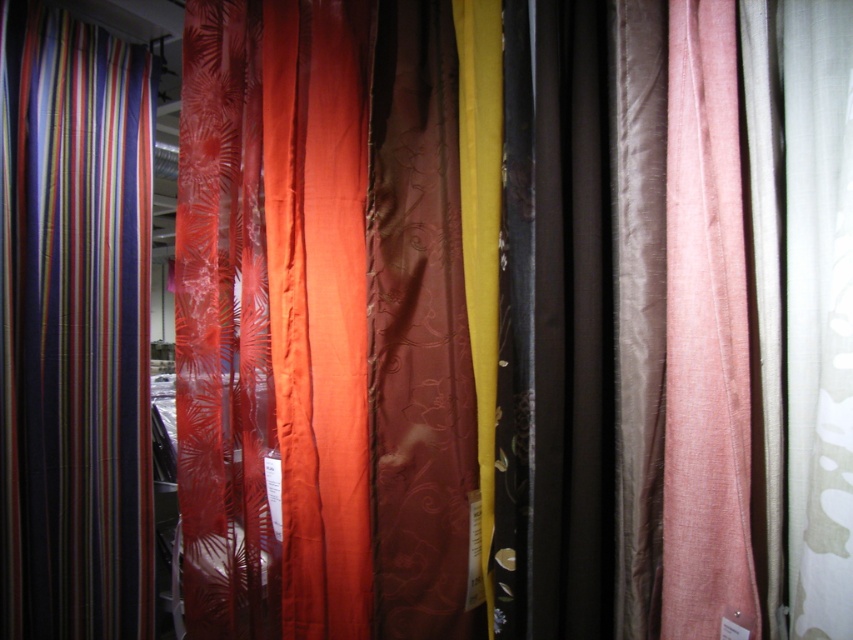
Can you confirm if multicolored striped fabric at left is shorter than satin orange curtain at center?

In fact, multicolored striped fabric at left may be taller than satin orange curtain at center.

Is multicolored striped fabric at left taller than satin orange curtain at center?

Yes.

Is point (109, 122) positioned behind point (318, 573)?

Yes, it is behind point (318, 573).

Where is `multicolored striped fabric at left`? multicolored striped fabric at left is located at coordinates (73, 328).

Does satin orange curtain at center have a greater height compared to pink sheer curtain at right?

Indeed, satin orange curtain at center has a greater height compared to pink sheer curtain at right.

Can you confirm if satin orange curtain at center is positioned below pink sheer curtain at right?

Incorrect, satin orange curtain at center is not positioned below pink sheer curtain at right.

Which is behind, point (288, 28) or point (701, 385)?

The point (288, 28) is behind.

Where is `satin orange curtain at center`? The image size is (853, 640). satin orange curtain at center is located at coordinates (318, 305).

Identify the location of multicolored striped fabric at left. The width and height of the screenshot is (853, 640). (73, 328).

Who is lower down, multicolored striped fabric at left or brown satin curtain at center?

multicolored striped fabric at left is below.

In the scene shown: Who is more distant from viewer, (x=88, y=118) or (x=422, y=536)?

The point (x=88, y=118) is behind.

Find the location of a particular element. This screenshot has width=853, height=640. multicolored striped fabric at left is located at coordinates (73, 328).